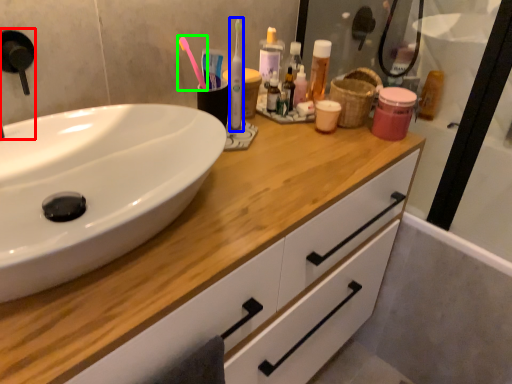
Question: Which object is the farthest from faucet (highlighted by a red box)? Choose among these: toothbrush (highlighted by a blue box) or toothbrush (highlighted by a green box).

Choices:
 (A) toothbrush
 (B) toothbrush

Answer: (A)